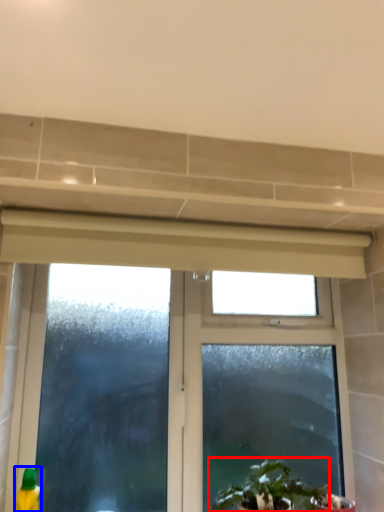
Question: Which of the following is the farthest to the observer, houseplant (highlighted by a red box) or cleaning product (highlighted by a blue box)?

Choices:
 (A) houseplant
 (B) cleaning product

Answer: (B)